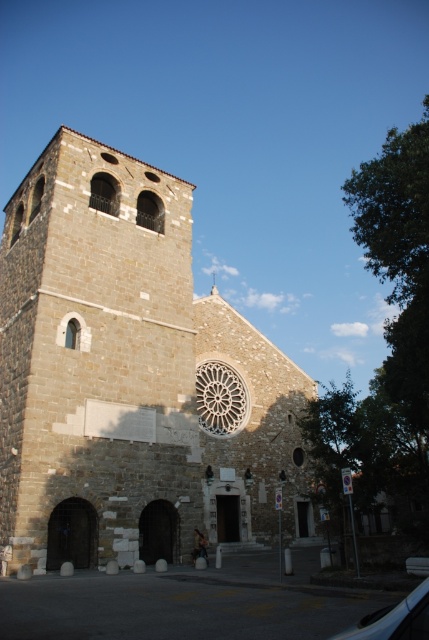
Question: From the image, what is the correct spatial relationship of brown stone church at center in relation to black rubber car at lower right?

Choices:
 (A) left
 (B) right

Answer: (A)

Question: Which point is farther to the camera?

Choices:
 (A) (150, 557)
 (B) (395, 634)

Answer: (A)

Question: Is brown stone church at center bigger than black rubber car at lower right?

Choices:
 (A) no
 (B) yes

Answer: (B)

Question: Can you confirm if brown stone church at center is bigger than black rubber car at lower right?

Choices:
 (A) yes
 (B) no

Answer: (A)

Question: Which point is farther to the camera?

Choices:
 (A) brown stone church at center
 (B) black rubber car at lower right

Answer: (A)